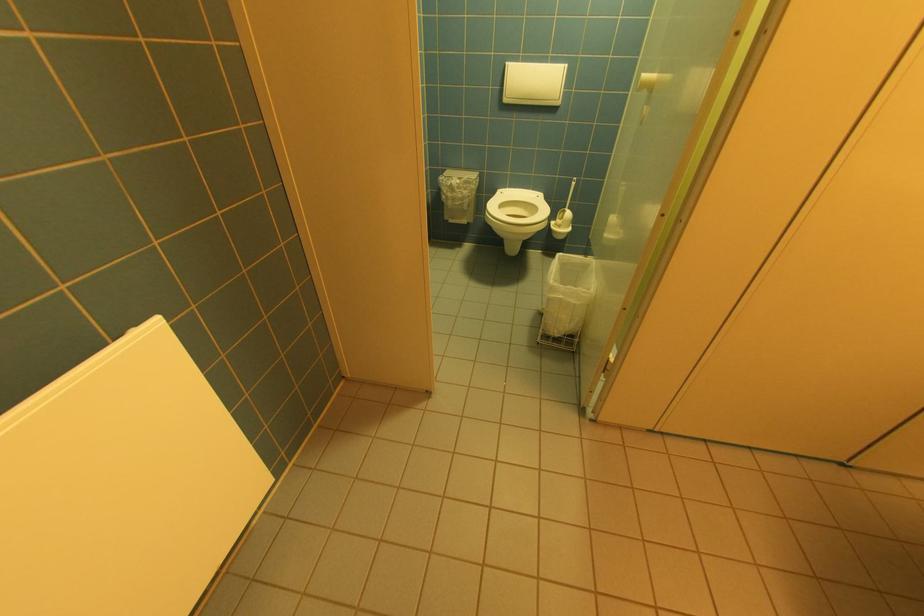
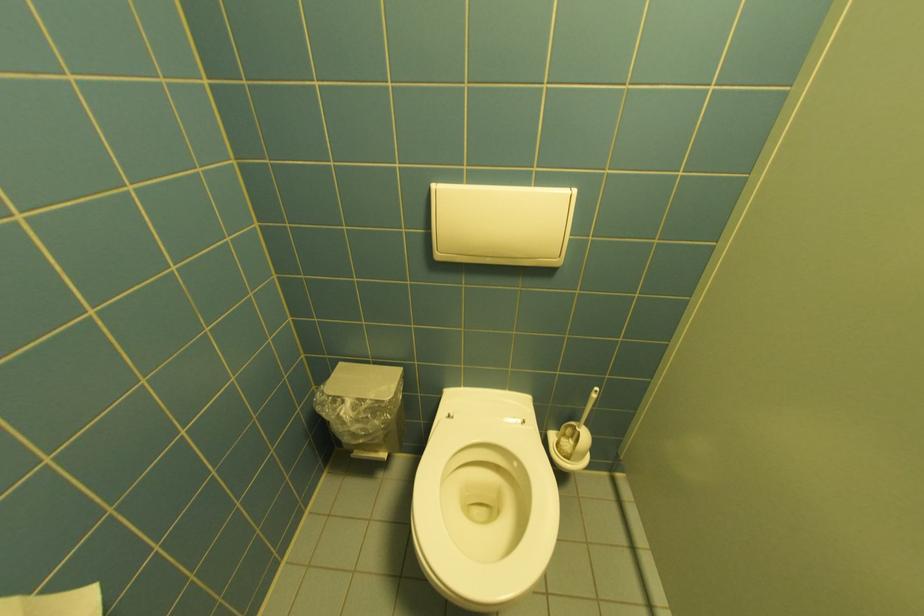
Where in the second image is the point corresponding to pixel 513 63 from the first image?

(440, 185)